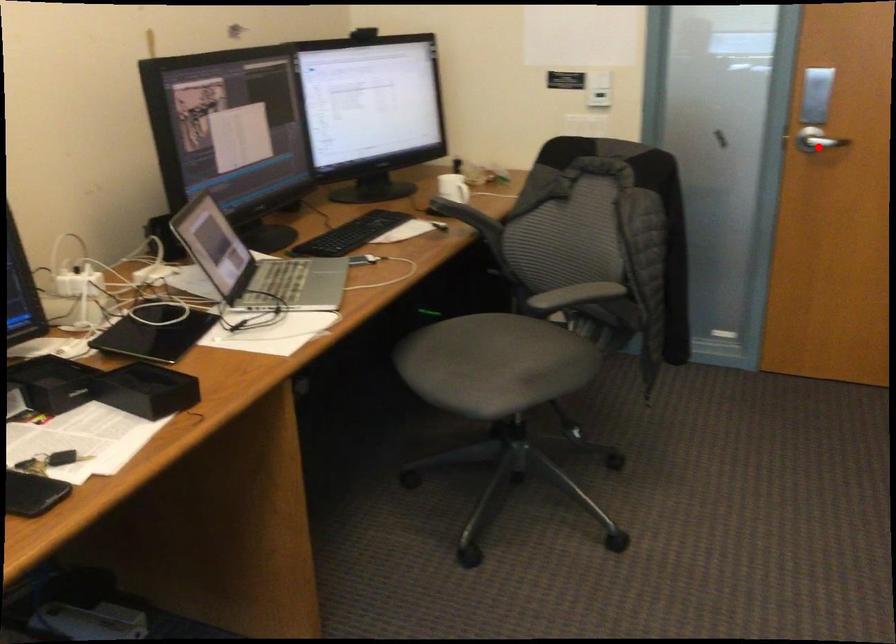
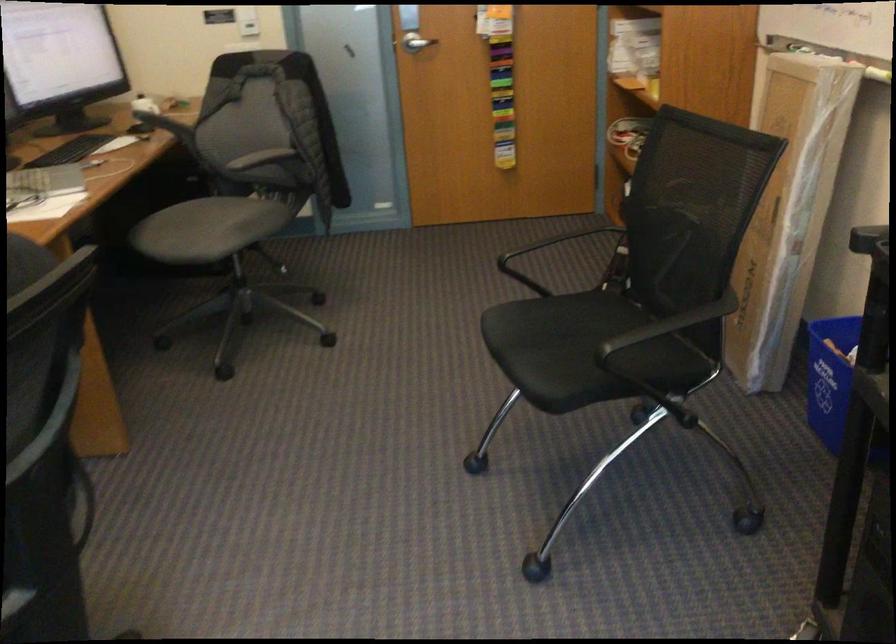
In the second image, find the point that corresponds to the highlighted location in the first image.

(415, 43)